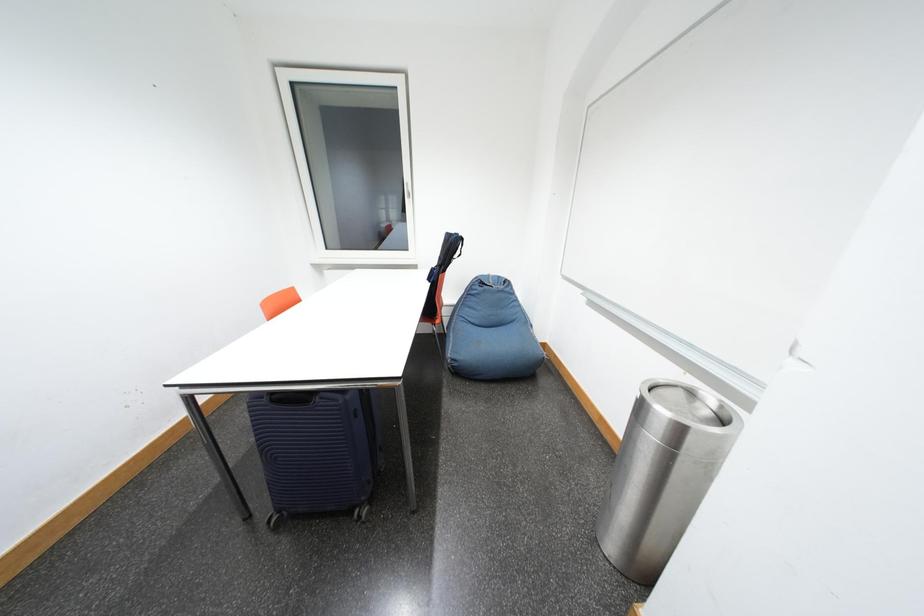
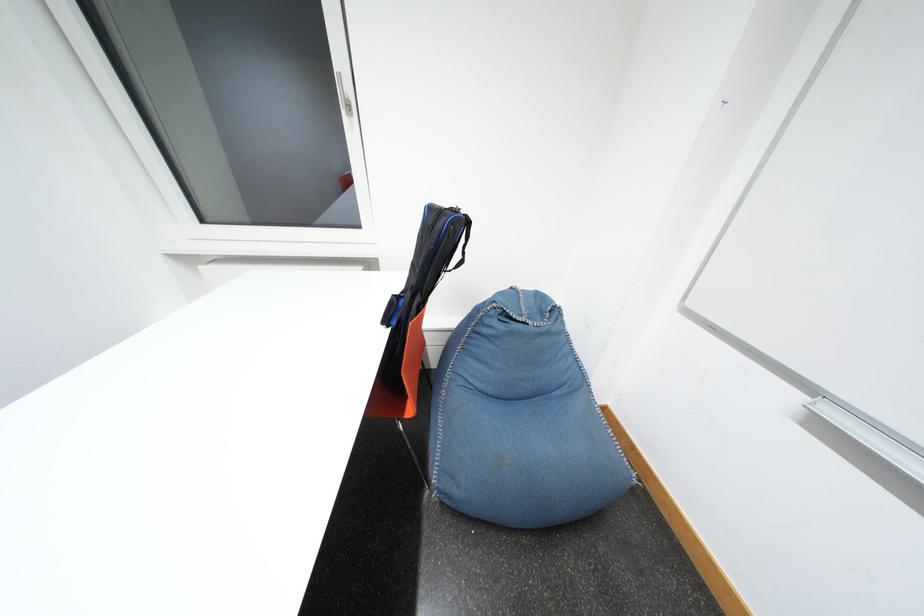
Question: In a continuous first-person perspective shot, in which direction is the camera moving?

Choices:
 (A) Left
 (B) Right
 (C) Forward
 (D) Backward

Answer: (C)